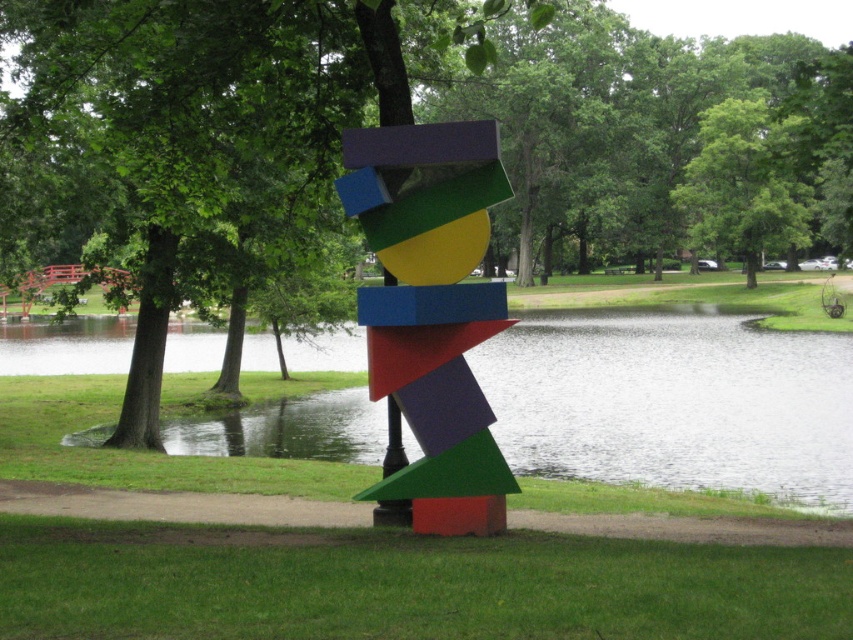
Question: Among these objects, which one is nearest to the camera?

Choices:
 (A) transparent glass water at center
 (B) matte plastic pole at center

Answer: (B)

Question: Which point is closer to the camera?

Choices:
 (A) transparent glass water at center
 (B) green matte tree at center

Answer: (B)

Question: Which object is the closest to the green leafy tree at upper center?

Choices:
 (A) transparent glass water at center
 (B) green matte tree at center
 (C) multicolored painted blocks at center
 (D) matte plastic pole at center

Answer: (B)

Question: Can you confirm if transparent glass water at center is wider than matte plastic pole at center?

Choices:
 (A) no
 (B) yes

Answer: (B)

Question: Does green matte tree at center come behind matte plastic pole at center?

Choices:
 (A) yes
 (B) no

Answer: (B)

Question: Is green leafy tree at upper center further to the viewer compared to matte plastic pole at center?

Choices:
 (A) no
 (B) yes

Answer: (B)